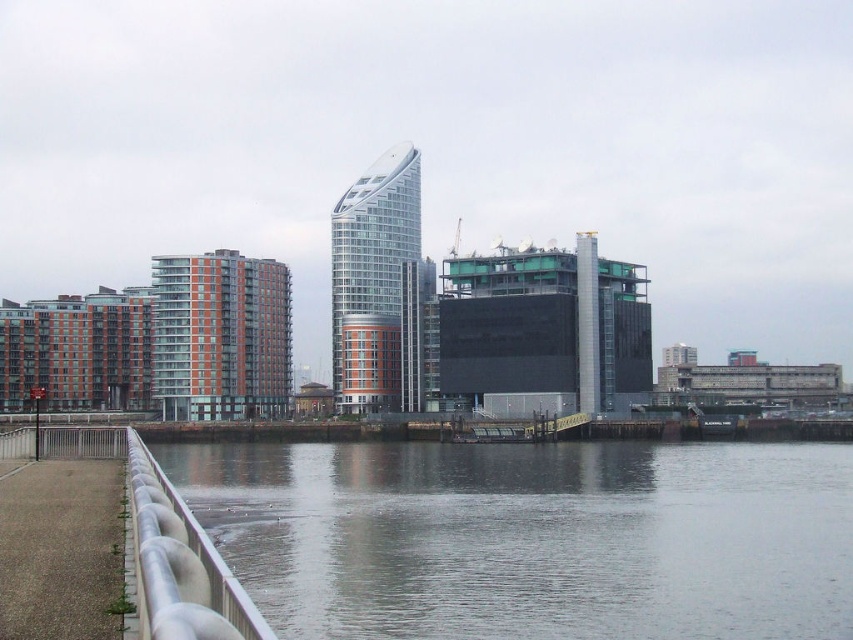
Which of these two, smooth gray water at lower center or white glossy rail at lower left, stands taller?

With more height is smooth gray water at lower center.

This screenshot has height=640, width=853. Find the location of `smooth gray water at lower center`. smooth gray water at lower center is located at coordinates (531, 538).